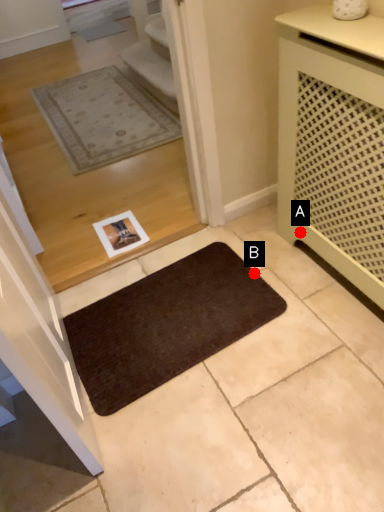
Question: Two points are circled on the image, labeled by A and B beside each circle. Among these points, which one is farthest from the camera?

Choices:
 (A) A is further
 (B) B is further

Answer: (A)